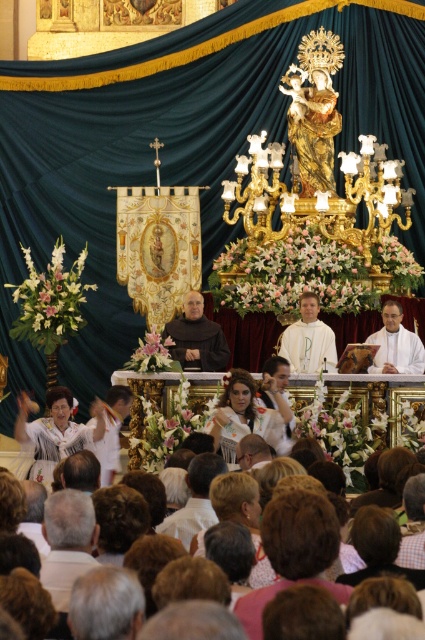
You are an event planner organizing a ceremony. You need to ensure there is enough space on the altar for a decorative arrangement. Given the white cloth at center and the white clothed person at center, which one has a smaller width?

The white cloth at center has a smaller width than the white clothed person at center according to the description.

You are standing at the back of the church during the ceremony. You want to walk towards the altar. Which point, point (x=53, y=598) or point (x=303, y=321), is closer to you?

Point (x=53, y=598) is in front of point (x=303, y=321), so the closer point to you is point (x=303, y=321).

You are a photographer standing at the camera position. You want to capture a closeup shot of the white cloth at lower center. Given that your camera has a maximum zoom range of 50 meters, will you be able to take the photo without moving closer?

The white cloth at lower center and the camera are 51.32 meters apart. Since the maximum zoom range is 50 meters, the photographer cannot capture the closeup shot without moving closer.